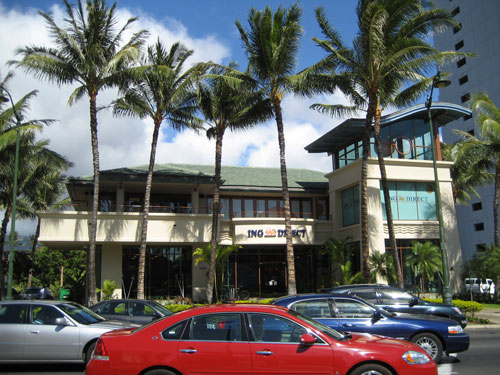
Find the location of a particular element. This screenshot has width=500, height=375. door handle is located at coordinates (34, 332).